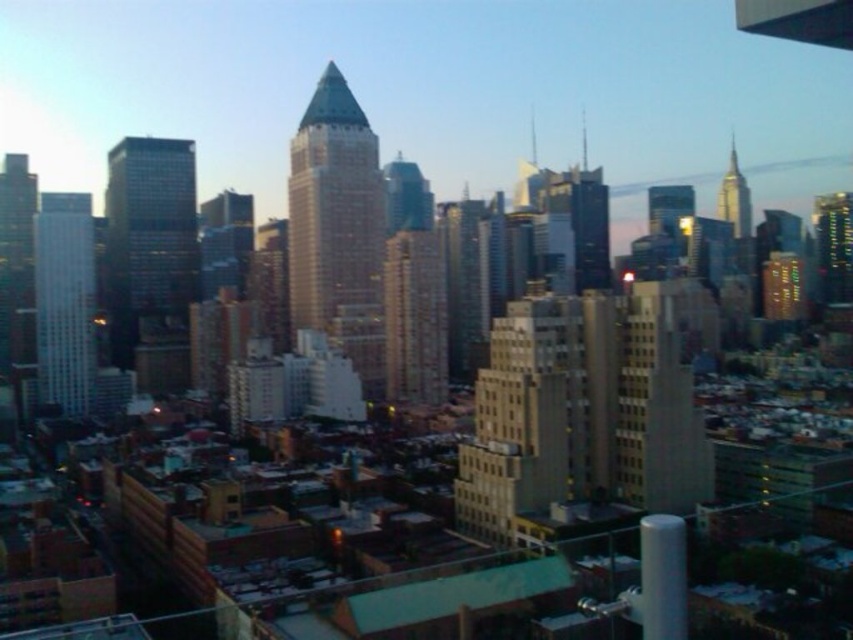
Does sleek glass skyscraper at center appear on the right side of smooth glass skyscraper at left?

Correct, you'll find sleek glass skyscraper at center to the right of smooth glass skyscraper at left.

Is point (293, 278) behind point (61, 371)?

Yes, it is.

Identify the location of sleek glass skyscraper at center. The height and width of the screenshot is (640, 853). (337, 228).

Find the location of a particular element. This screenshot has width=853, height=640. sleek glass skyscraper at center is located at coordinates (337, 228).

Does point (293, 321) lie behind point (741, 198)?

No, (293, 321) is closer to viewer.

Image resolution: width=853 pixels, height=640 pixels. Describe the element at coordinates (337, 228) in the screenshot. I see `sleek glass skyscraper at center` at that location.

The height and width of the screenshot is (640, 853). In order to click on sleek glass skyscraper at center in this screenshot , I will do `click(337, 228)`.

Does smooth glass skyscraper at left have a larger size compared to gold reflective spire at upper right?

A: Yes, smooth glass skyscraper at left is bigger than gold reflective spire at upper right.

Can you confirm if smooth glass skyscraper at left is positioned to the left of gold reflective spire at upper right?

Yes, smooth glass skyscraper at left is to the left of gold reflective spire at upper right.

Does point (44, 317) lie in front of point (737, 237)?

Yes.

At what (x,y) coordinates should I click in order to perform the action: click on smooth glass skyscraper at left. Please return your answer as a coordinate pair (x, y). The width and height of the screenshot is (853, 640). Looking at the image, I should click on (64, 301).